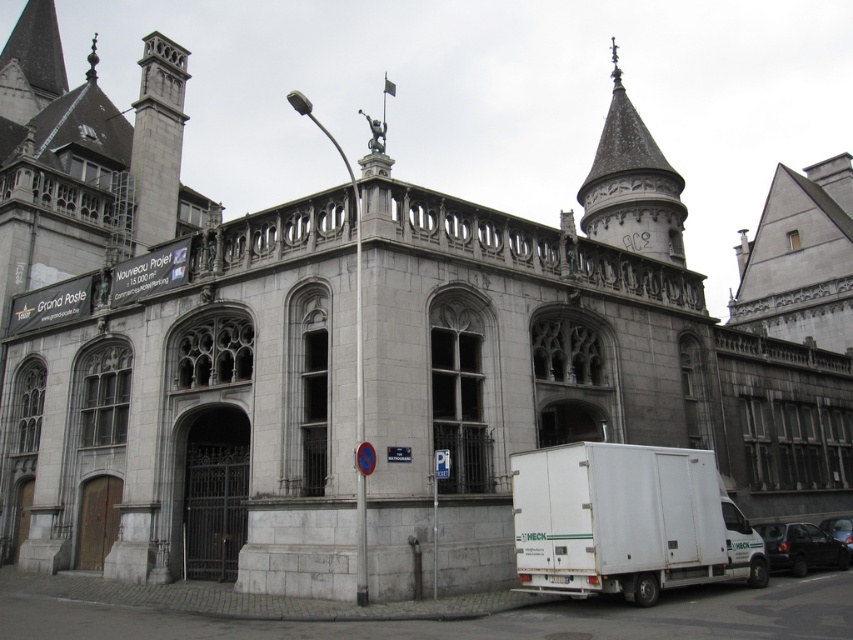
Who is shorter, gray stone spire at upper right or black matte van at lower right?

With less height is black matte van at lower right.

Between gray stone spire at upper right and black matte van at lower right, which one is positioned higher?

Positioned higher is gray stone spire at upper right.

Who is more forward, (612, 212) or (808, 563)?

Positioned in front is point (808, 563).

Identify the location of gray stone spire at upper right. This screenshot has height=640, width=853. (631, 186).

Which is behind, point (573, 515) or point (834, 534)?

Positioned behind is point (834, 534).

Is white matte truck at lower right taller than shiny black car at lower right?

Indeed, white matte truck at lower right has a greater height compared to shiny black car at lower right.

What do you see at coordinates (627, 522) in the screenshot? Image resolution: width=853 pixels, height=640 pixels. I see `white matte truck at lower right` at bounding box center [627, 522].

This screenshot has height=640, width=853. Identify the location of white matte truck at lower right. [x=627, y=522].

Who is shorter, gray stone spire at upper right or shiny black car at lower right?

With less height is shiny black car at lower right.

Can you confirm if gray stone spire at upper right is positioned to the right of shiny black car at lower right?

In fact, gray stone spire at upper right is to the left of shiny black car at lower right.

The image size is (853, 640). I want to click on gray stone spire at upper right, so click(x=631, y=186).

Where is `gray stone spire at upper right`? This screenshot has height=640, width=853. gray stone spire at upper right is located at coordinates (631, 186).